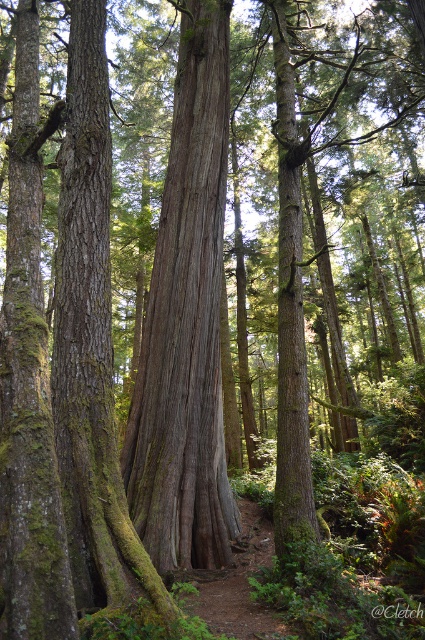
Is point (223, 122) positioned after point (93, 8)?

Yes, point (223, 122) is behind point (93, 8).

This screenshot has height=640, width=425. I want to click on brown rough bark tree trunk at center, so click(x=186, y=323).

Is point (206, 538) positioned after point (214, 605)?

Yes.

Where is `brown rough bark tree trunk at center`? brown rough bark tree trunk at center is located at coordinates (186, 323).

Can you confirm if green mossy bark tree trunk at left is taller than dirt path at center?

Yes, green mossy bark tree trunk at left is taller than dirt path at center.

Is the position of green mossy bark tree trunk at left more distant than that of dirt path at center?

No.

Between point (74, 289) and point (263, 525), which one is positioned in front?

Point (74, 289) is in front.

This screenshot has height=640, width=425. I want to click on green mossy bark tree trunk at left, so (90, 344).